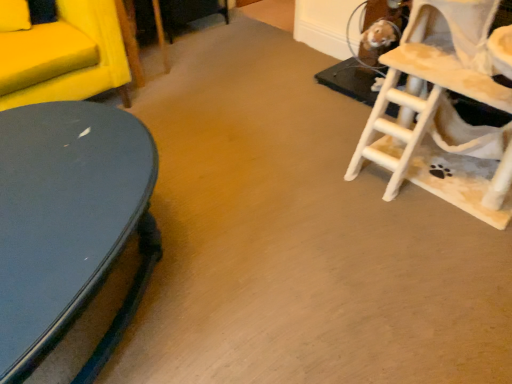
The height and width of the screenshot is (384, 512). Find the location of `free space to the back side of glossy dark blue table at left`. free space to the back side of glossy dark blue table at left is located at coordinates (199, 136).